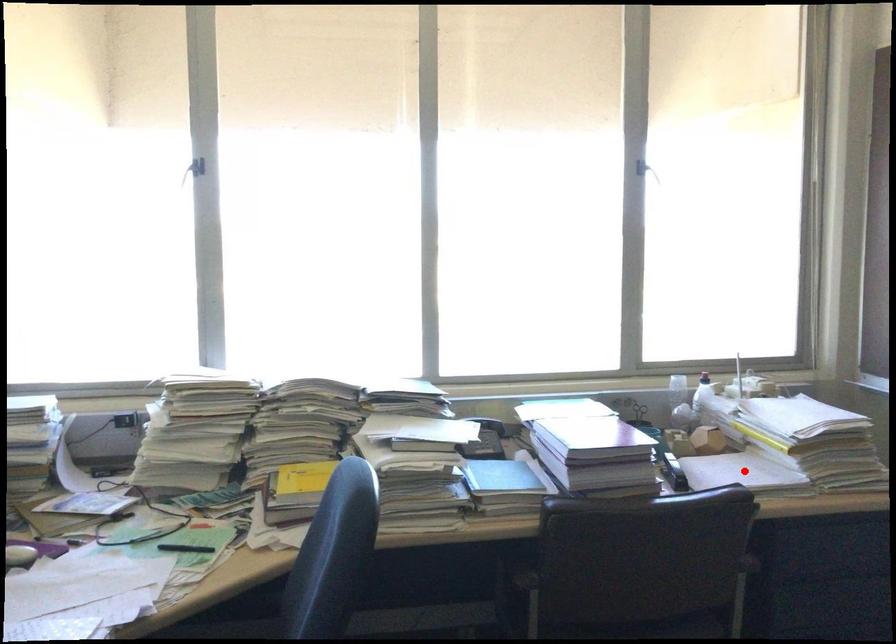
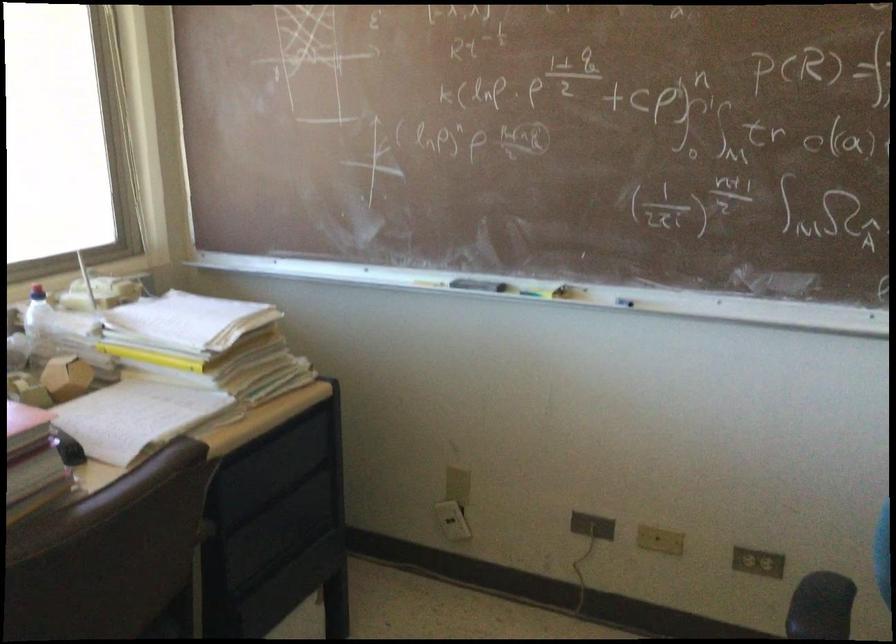
The point at the highlighted location is marked in the first image. Where is the corresponding point in the second image?

(135, 417)